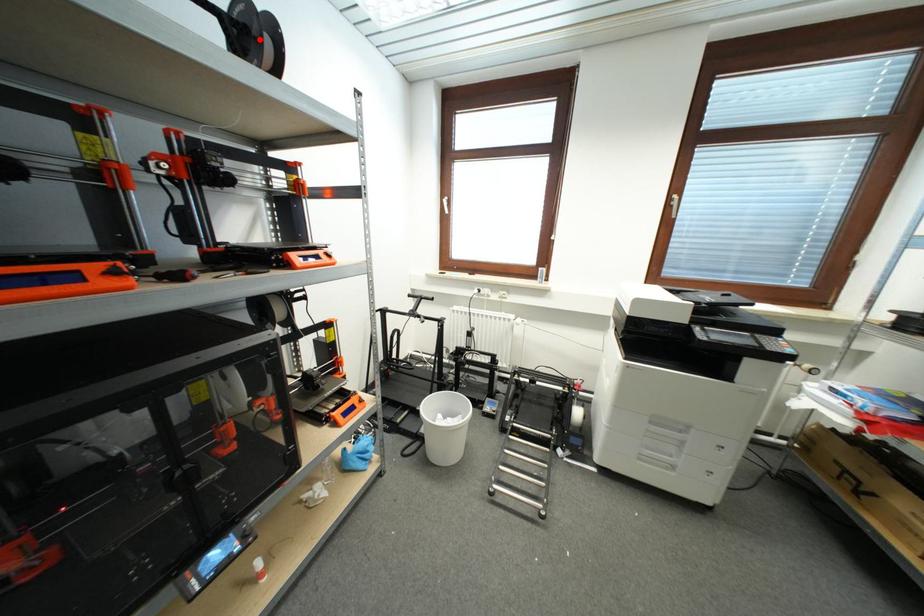
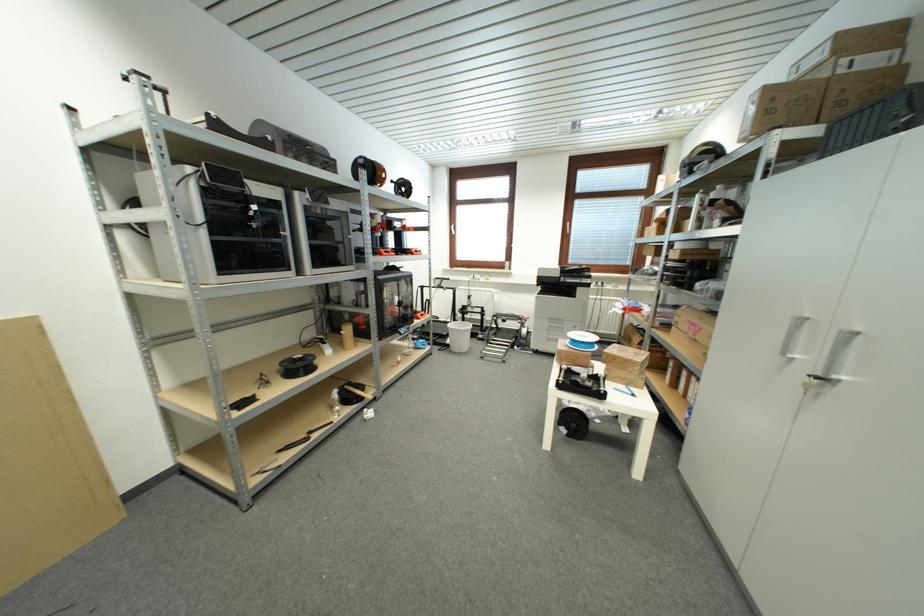
Question: A red point is marked in image1. In image2, is the corresponding 3D point closer to the camera or farther? Reply with the corresponding letter.

Choices:
 (A) The corresponding 3D point is closer.
 (B) The corresponding 3D point is farther.

Answer: (A)